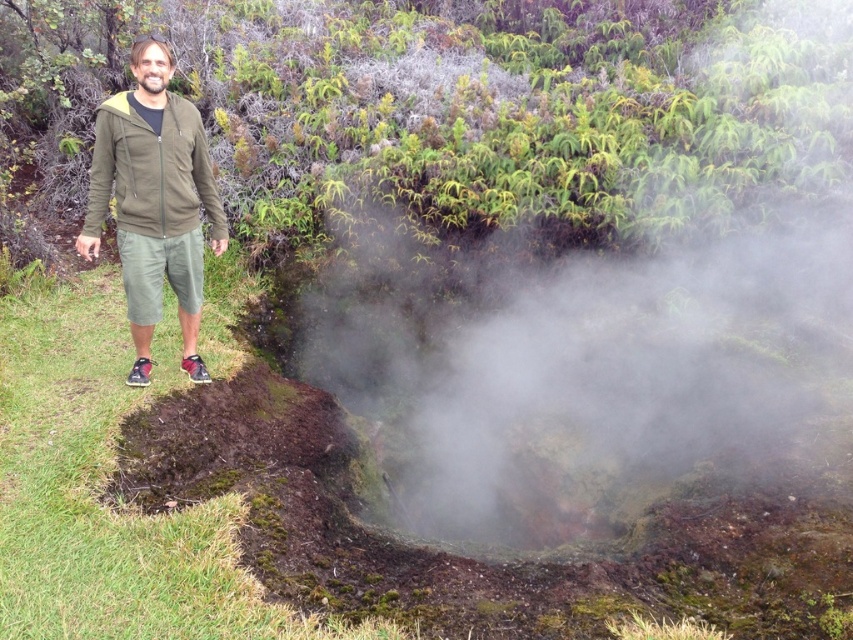
Question: Which point appears closest to the camera in this image?

Choices:
 (A) (498, 372)
 (B) (102, 124)
 (C) (140, 276)

Answer: (B)

Question: Which point appears closest to the camera in this image?

Choices:
 (A) (173, 134)
 (B) (496, 301)
 (C) (190, 248)

Answer: (A)

Question: Which point is farther to the camera?

Choices:
 (A) (125, 291)
 (B) (521, 177)
 (C) (119, 195)

Answer: (B)

Question: From the image, what is the correct spatial relationship of white misty steam at center in relation to matte olive green jacket at left?

Choices:
 (A) below
 (B) above

Answer: (A)

Question: Is white misty steam at center below green matte jacket at left?

Choices:
 (A) yes
 (B) no

Answer: (A)

Question: Is white misty steam at center thinner than green matte jacket at left?

Choices:
 (A) no
 (B) yes

Answer: (A)